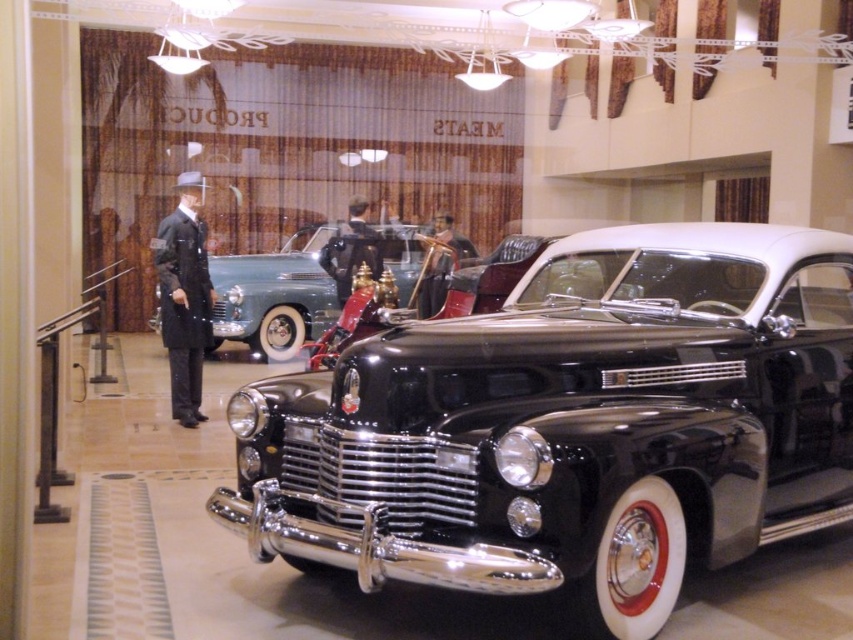
You are a visitor at the vintage car exhibit and want to take a photo of the shiny chrome pickup at center without any obstructions. However, the matte black suit at left is blocking the view. Can you move the suit to the side to get a clear shot?

The shiny chrome pickup at center is positioned under the matte black suit at left, so moving the matte black suit at left to the side would allow an unobstructed view of the shiny chrome pickup at center.

You are a tour guide leading a group through the vintage car exhibit. You need to ensure that the shiny black car at center and the smooth leather jacket at center are spaced appropriately for visitors to walk between them. Given that the average visitor requires 3 feet of space to move comfortably, can visitors comfortably walk between these two items?

The shiny black car at center and the smooth leather jacket at center are 4.08 feet apart from each other. Since the average visitor requires 3 feet of space, visitors can comfortably walk between them as the distance provided exceeds the required space.

You are standing in the vintage car exhibit and see the point at coordinates (572, 426). Based on the scene description, what object is this point located on?

The point at coordinates (572, 426) is located on the shiny chrome pickup at center.